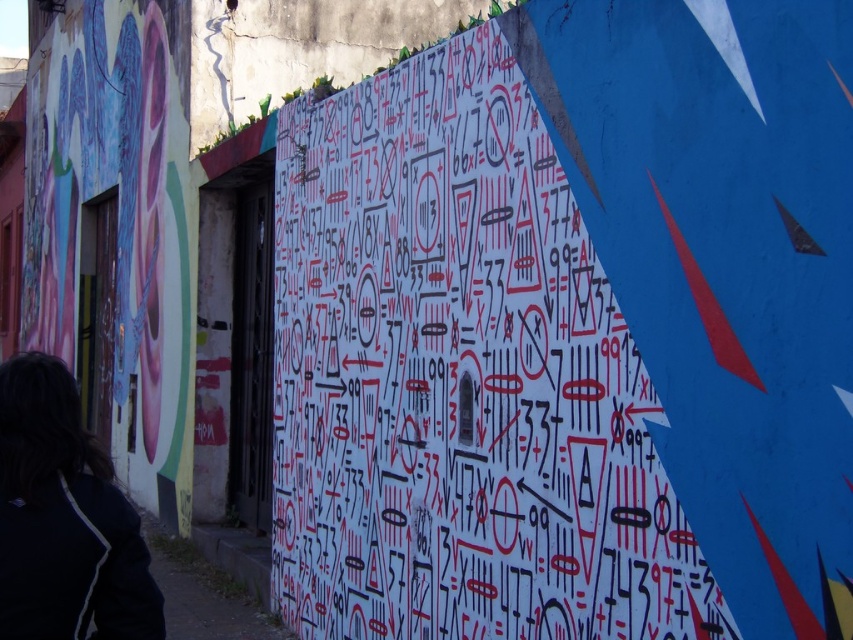
You are an artist standing in front of the urban wall art scene. You need to place a new sticker exactly at the center of the white paper with red and black markings at center. According to the coordinates provided, where should you place the sticker?

The sticker should be placed at the coordinates point (459, 380) since that is the 2D location of the white paper with red and black markings at center.

You are an artist standing in front of the urban wall art scene. You notice the white paper with red and black markings at center and the black fabric at lower left. Which object is positioned higher in the scene?

The white paper with red and black markings at center is above the black fabric at lower left, so it is positioned higher in the scene.